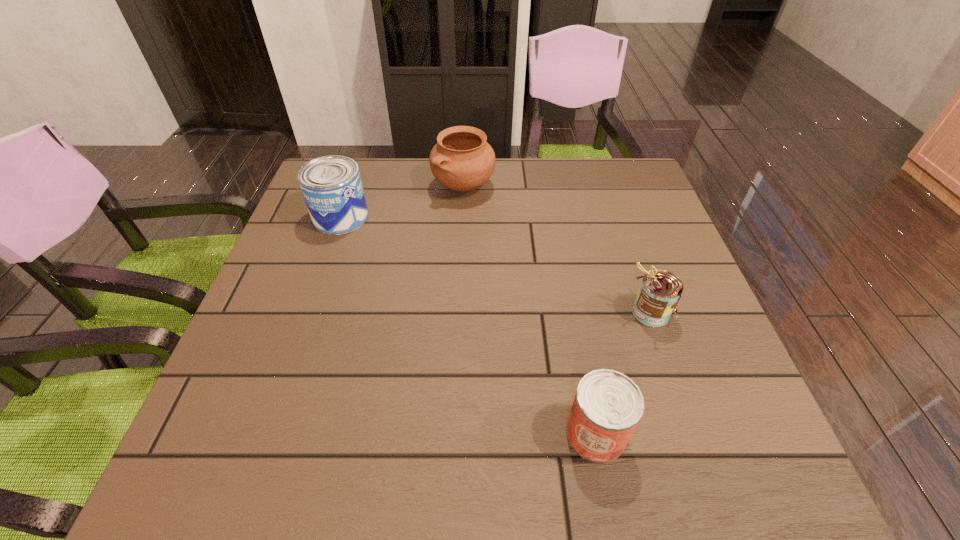
Where is `vacant space at the right edge of the desktop`? vacant space at the right edge of the desktop is located at coordinates (629, 313).

Locate an element on the screen. free space at the far right corner of the desktop is located at coordinates (592, 168).

Locate an element on the screen. vacant space that is in between the leftmost can and the rightmost can is located at coordinates (495, 265).

Identify the location of vacant point located between the pottery and the leftmost can. The width and height of the screenshot is (960, 540). (402, 201).

This screenshot has height=540, width=960. I want to click on free area in between the pottery and the leftmost can, so click(x=402, y=201).

Where is `empty space that is in between the second can from left to right and the rightmost can`? The image size is (960, 540). empty space that is in between the second can from left to right and the rightmost can is located at coordinates (623, 373).

Image resolution: width=960 pixels, height=540 pixels. I want to click on vacant area that lies between the nearest can and the leftmost object, so click(468, 326).

Identify the location of empty space between the rightmost can and the farthest can. (495, 265).

The image size is (960, 540). Identify the location of vacant point located between the nearest can and the third object from right to left. (530, 309).

Identify the location of vacant point located between the nearest can and the leftmost object. (468, 326).